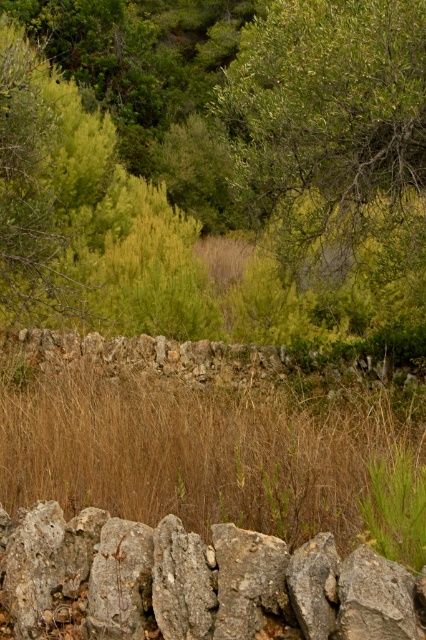
Question: Which point is closer to the camera?

Choices:
 (A) (411, 40)
 (B) (383, 538)
 (C) (383, 636)
 (D) (273, 515)

Answer: (C)

Question: Which of the following is the farthest from the observer?

Choices:
 (A) (288, 525)
 (B) (5, 515)
 (C) (362, 72)
 (D) (420, 544)

Answer: (C)

Question: Can you confirm if green leafy tree at center is positioned above gray rough stone at center?

Choices:
 (A) yes
 (B) no

Answer: (A)

Question: Is brown dry grass at center positioned at the back of gray rough stone at center?

Choices:
 (A) yes
 (B) no

Answer: (A)

Question: Which point is farther to the camera?

Choices:
 (A) gray rough stone at center
 (B) green grass at center
 (C) brown dry grass at center
 (D) green leafy tree at center

Answer: (D)

Question: Can you confirm if green leafy tree at center is bigger than brown dry grass at center?

Choices:
 (A) no
 (B) yes

Answer: (B)